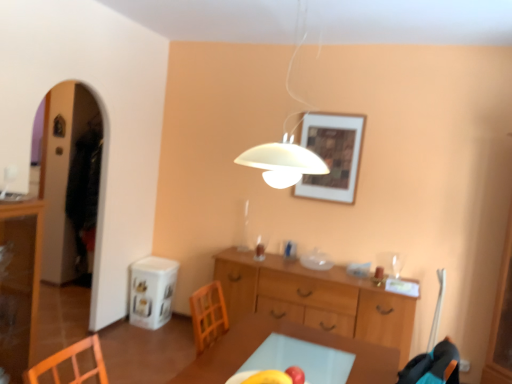
Question: From the image's perspective, does yellow matte apple at center appear lower than wooden cabinet at center?

Choices:
 (A) no
 (B) yes

Answer: (A)

Question: Is yellow matte apple at center outside wooden cabinet at center?

Choices:
 (A) no
 (B) yes

Answer: (B)

Question: Considering the relative sizes of yellow matte apple at center and wooden cabinet at center in the image provided, is yellow matte apple at center bigger than wooden cabinet at center?

Choices:
 (A) no
 (B) yes

Answer: (A)

Question: Is yellow matte apple at center taller than wooden cabinet at center?

Choices:
 (A) no
 (B) yes

Answer: (A)

Question: Is the position of yellow matte apple at center less distant than that of wooden cabinet at center?

Choices:
 (A) no
 (B) yes

Answer: (B)

Question: Considering the positions of yellow matte apple at center and transparent glass cabinet at left in the image, is yellow matte apple at center wider or thinner than transparent glass cabinet at left?

Choices:
 (A) thin
 (B) wide

Answer: (A)

Question: Is yellow matte apple at center in front of or behind transparent glass cabinet at left in the image?

Choices:
 (A) behind
 (B) front

Answer: (B)

Question: From the image's perspective, is yellow matte apple at center positioned above or below transparent glass cabinet at left?

Choices:
 (A) below
 (B) above

Answer: (A)

Question: Looking at the image, does yellow matte apple at center seem bigger or smaller compared to transparent glass cabinet at left?

Choices:
 (A) small
 (B) big

Answer: (A)

Question: Considering the positions of point (243, 279) and point (302, 13), is point (243, 279) closer or farther from the camera than point (302, 13)?

Choices:
 (A) farther
 (B) closer

Answer: (A)

Question: Based on their sizes in the image, would you say wooden cabinet at center is bigger or smaller than white matte lampshade at upper center?

Choices:
 (A) small
 (B) big

Answer: (B)

Question: Considering their positions, is wooden cabinet at center located in front of or behind white matte lampshade at upper center?

Choices:
 (A) behind
 (B) front

Answer: (A)

Question: Choose the correct answer: Is wooden cabinet at center inside white matte lampshade at upper center or outside it?

Choices:
 (A) inside
 (B) outside

Answer: (B)

Question: Is point (344, 175) positioned closer to the camera than point (279, 142)?

Choices:
 (A) farther
 (B) closer

Answer: (B)

Question: From a real-world perspective, is wooden framed artwork at upper center physically located above or below white matte lampshade at upper center?

Choices:
 (A) above
 (B) below

Answer: (B)